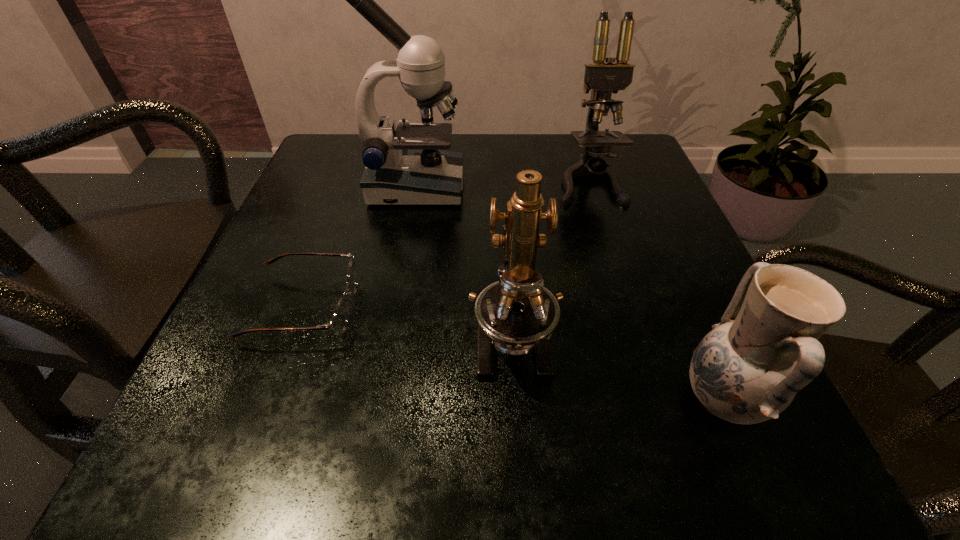
Image resolution: width=960 pixels, height=540 pixels. What are the coordinates of `the tallest object` in the screenshot? It's located at (407, 165).

Find the location of `the tallest microscope`. the tallest microscope is located at coordinates (407, 165).

Where is `the rightmost microscope`? The height and width of the screenshot is (540, 960). the rightmost microscope is located at coordinates (603, 79).

Locate an element on the screen. the second microscope from right to left is located at coordinates (517, 314).

At what (x,y) coordinates should I click in order to perform the action: click on the third object from right to left. Please return your answer as a coordinate pair (x, y). Looking at the image, I should click on (517, 314).

I want to click on pottery, so click(748, 369).

Find the location of a particular element. the shortest object is located at coordinates (339, 320).

At what (x,y) coordinates should I click in order to perform the action: click on vacant space located at the eyepiece of the tallest microscope. Please return your answer as a coordinate pair (x, y). Looking at the image, I should click on (647, 187).

Identify the location of free space located at the eyepieces of the rightmost microscope. This screenshot has height=540, width=960. (624, 296).

Locate an element on the screen. vacant area located at the eyepiece of the second microscope from right to left is located at coordinates click(517, 440).